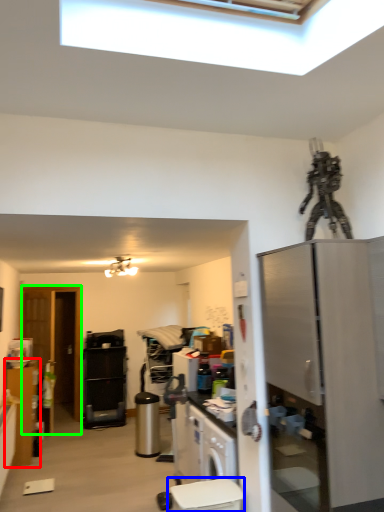
Question: Estimate the real-world distances between objects in this image. Which object is farther from cabinetry (highlighted by a red box), toilet bowl (highlighted by a blue box) or glass door (highlighted by a green box)?

Choices:
 (A) toilet bowl
 (B) glass door

Answer: (A)